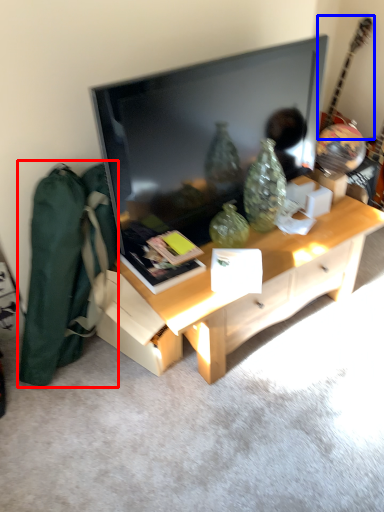
Question: Which object is further to the camera taking this photo, messenger bag (highlighted by a red box) or guitar (highlighted by a blue box)?

Choices:
 (A) messenger bag
 (B) guitar

Answer: (B)